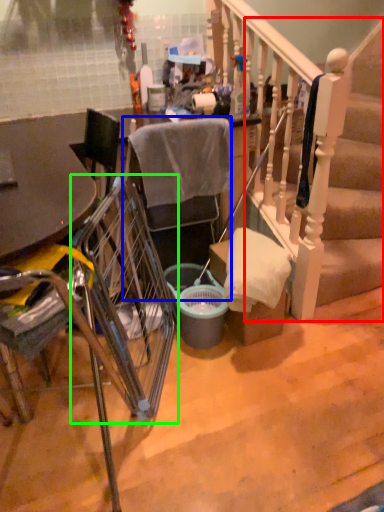
Question: Estimate the real-world distances between objects in this image. Which object is farther from stairs (highlighted by a red box), chair (highlighted by a blue box) or trolley (highlighted by a green box)?

Choices:
 (A) chair
 (B) trolley

Answer: (B)